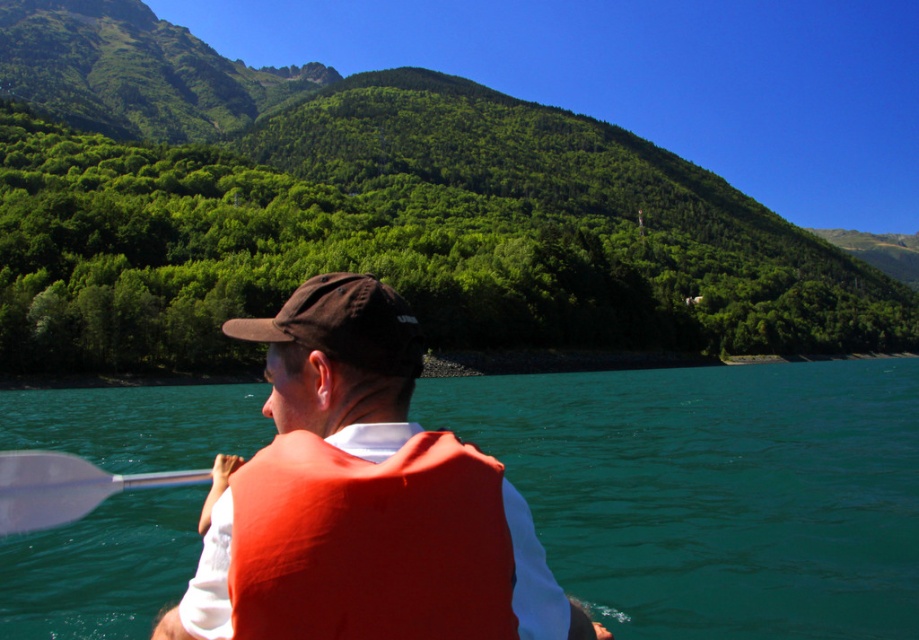
You are a drone operator tasked with capturing aerial footage of the scene. The teal glossy water at center and orange life vest at center are two key elements you need to film simultaneously. Given that your drone camera has a maximum horizontal field of view of 48 meters, will you be able to frame both objects in a single shot?

The teal glossy water at center and orange life vest at center are 48.45 meters apart. Since the drone camera has a maximum horizontal field of view of 48 meters, which is slightly less than the distance between the two objects, you will not be able to frame both in a single shot.

You are a safety inspector reviewing this scene. The safety regulations require that the life vest must be positioned within the central 50x50 pixel area of the image. The image has a resolution of 1000x1000 pixels. Given the coordinates of the orange life vest at center, is it compliant with the safety regulations?

The orange life vest at center is located at coordinates point (362, 499). Since the image is 1000x1000 pixels, the central 50x50 pixel area spans from 475 to 525 pixels in both x and y directions. The coordinates of the orange life vest at center fall within this central area, so it is compliant with the safety regulations.